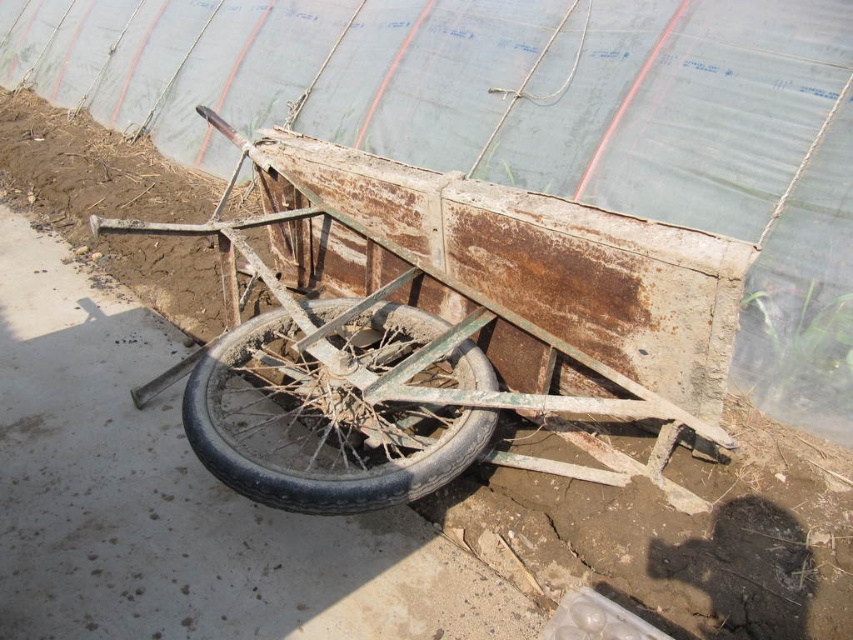
You are a farmer who needs to transport a heavy bag of soil. You have a rusty metal cart at center and a rusty metal wheel at lower center. Which object can you use to carry the bag?

The rusty metal cart at center is larger in size than the rusty metal wheel at lower center, so you should use the rusty metal cart at center to carry the heavy bag of soil.